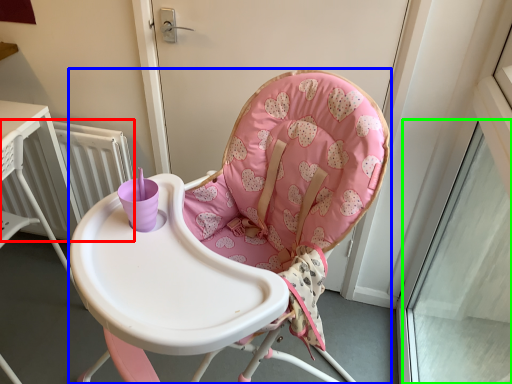
Question: Estimate the real-world distances between objects in this image. Which object is farther from radiator (highlighted by a red box), chair (highlighted by a blue box) or window (highlighted by a green box)?

Choices:
 (A) chair
 (B) window

Answer: (B)